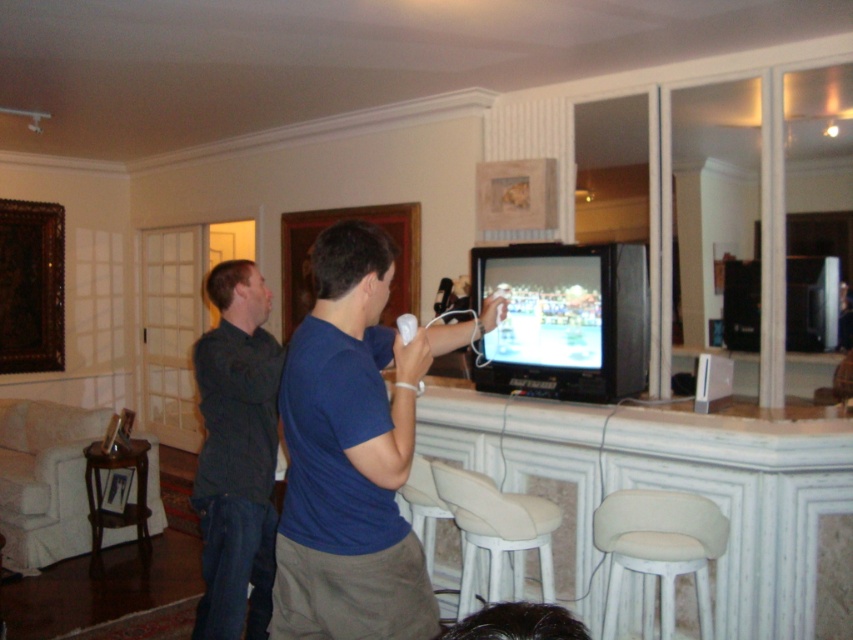
Based on the photo, you are standing in the room and want to hand a drink to the person wearing the blue cotton shirt at center. Which side of the brown wooden bar stool at lower left should you approach from to reach them?

You should approach from the right side of the brown wooden bar stool at lower left because the blue cotton shirt at center is positioned to the right of it.

Based on the photo, you are sitting on the brown wooden bar stool at lower left and want to pick up the white matte remote at center. Is the remote within easy reach from your current position?

The brown wooden bar stool at lower left is positioned under the white matte remote at center, so the remote is directly below you. You can easily reach down to pick it up.

You are a person who is 1.7 meters tall and want to sit on one of the stools in the room. Which stool, the white fabric bar stool at lower right or the beige fabric stool at lower center, would be more comfortable for you to reach the TV remote placed on the coffee table in front of them?

The beige fabric stool at lower center is shorter, so sitting on it would allow you to reach the TV remote on the coffee table more comfortably than the taller white fabric bar stool at lower right.